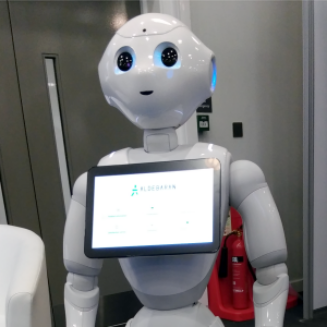
The width and height of the screenshot is (327, 327). I want to click on fire extinguisher, so click(238, 272).